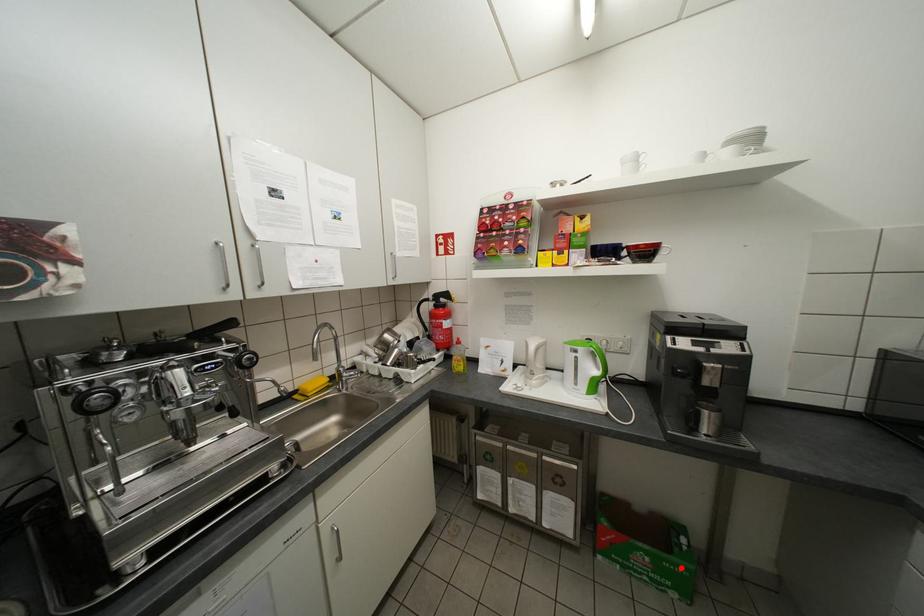
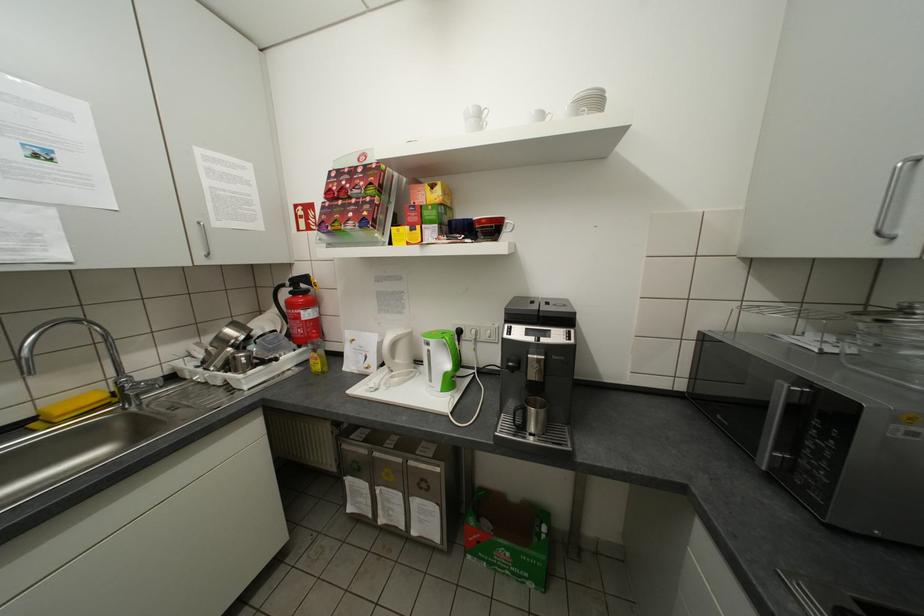
Question: A red point is marked in image1. In image2, is the corresponding 3D point closer to the camera or farther? Reply with the corresponding letter.

Choices:
 (A) The corresponding 3D point is closer.
 (B) The corresponding 3D point is farther.

Answer: (B)